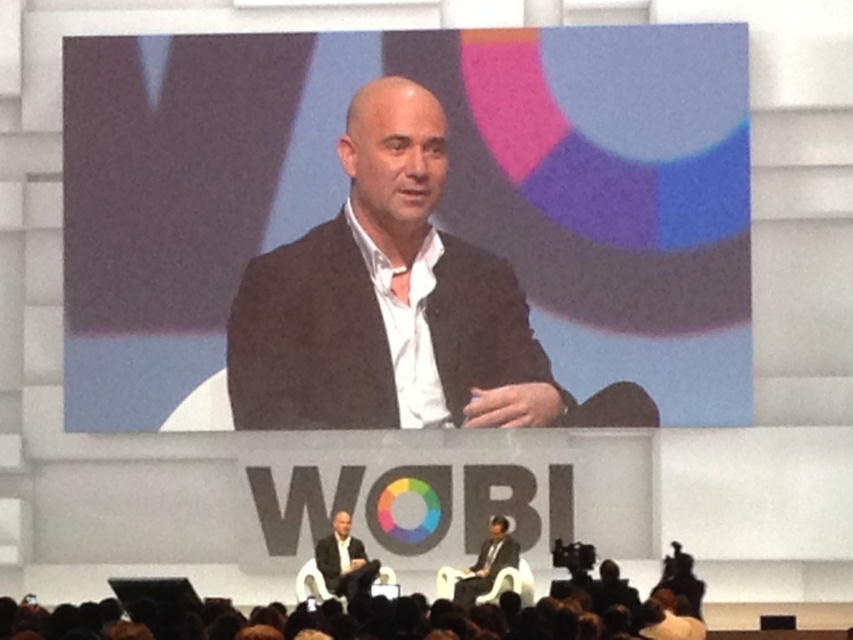
Who is more distant from viewer, (650, 244) or (607, 600)?

Point (650, 244)

Does matte black screen at center have a lesser width compared to brown hair at lower center?

No, matte black screen at center is not thinner than brown hair at lower center.

The image size is (853, 640). I want to click on matte black screen at center, so click(438, 205).

Measure the distance between matte black screen at center and dark gray suit at center.

A distance of 11.08 meters exists between matte black screen at center and dark gray suit at center.

Who is shorter, matte black screen at center or dark gray suit at center?

Standing shorter between the two is dark gray suit at center.

The height and width of the screenshot is (640, 853). Identify the location of matte black screen at center. (438, 205).

Does brown hair at lower center appear on the left side of dark gray suit at center?

In fact, brown hair at lower center is to the right of dark gray suit at center.

What do you see at coordinates (384, 611) in the screenshot?
I see `brown hair at lower center` at bounding box center [384, 611].

Who is more forward, (221,628) or (349,589)?

Point (221,628)

At what (x,y) coordinates should I click in order to perform the action: click on brown hair at lower center. Please return your answer as a coordinate pair (x, y). The width and height of the screenshot is (853, 640). Looking at the image, I should click on (384, 611).